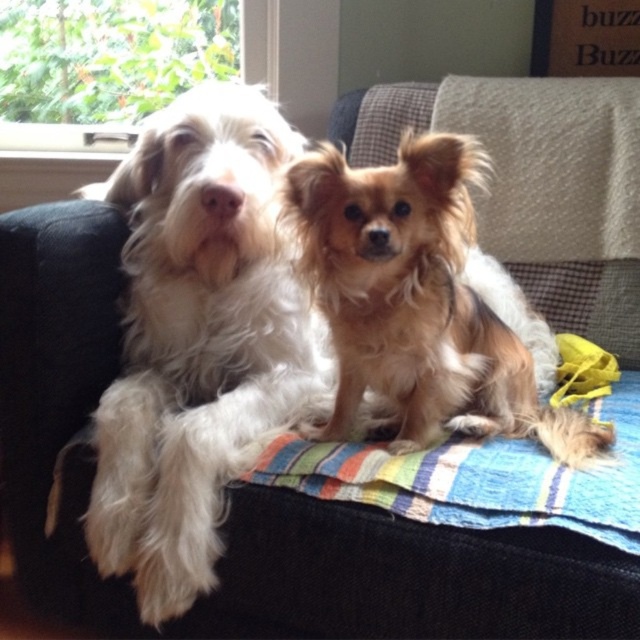
You are standing in front of the couch with two dogs. You want to place a treat exactly where the golden fur dog at center is sitting. What are the coordinates of the spot where you should place the treat?

The coordinates for the golden fur dog at center are at point (419, 301). You should place the treat there.

From the picture: You are a photographer trying to capture a closeup shot of the golden fur dog at center. The striped cotton blanket at center is in the way. Can you move the blanket sideways to the left to get a clear view of the dog?

The golden fur dog at center is thinner than the striped cotton blanket at center, so moving the blanket sideways to the left might not fully clear the dog since the blanket is wider. You may need to adjust the blanket more carefully or reposition the camera angle.